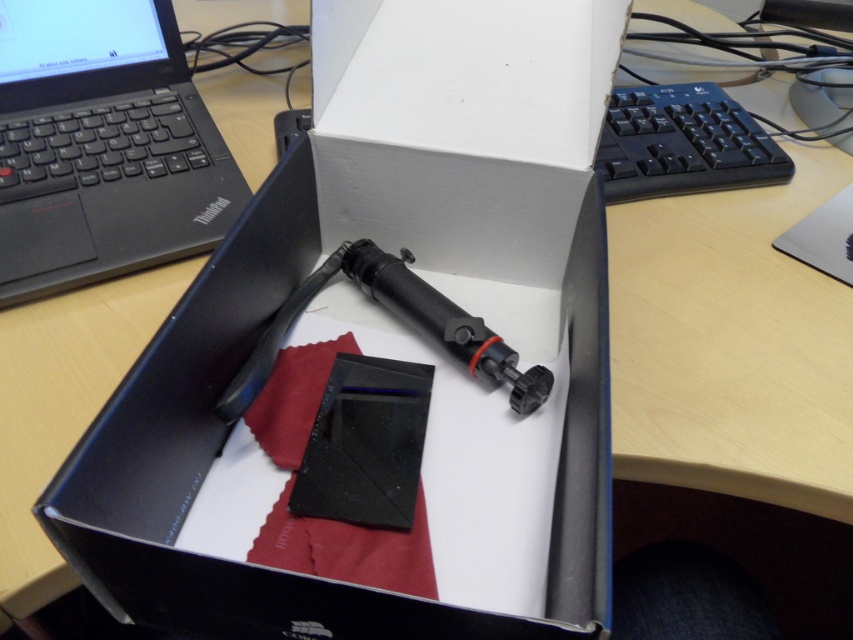
The image size is (853, 640). What do you see at coordinates (102, 145) in the screenshot?
I see `black matte thinkpad at upper left` at bounding box center [102, 145].

Does black matte thinkpad at upper left have a greater height compared to black plastic keyboard at upper right?

Yes.

Who is more distant from viewer, (x=173, y=104) or (x=612, y=193)?

The point (x=173, y=104) is behind.

Locate an element on the screen. The height and width of the screenshot is (640, 853). black matte thinkpad at upper left is located at coordinates (102, 145).

Is point (154, 51) farther from camera compared to point (537, 376)?

That is True.

Between point (235, 172) and point (392, 282), which one is positioned in front?

Positioned in front is point (392, 282).

Locate an element on the screen. This screenshot has height=640, width=853. black matte thinkpad at upper left is located at coordinates (102, 145).

Does black plastic keyboard at upper right appear on the left side of black rubberized pen at center?

Incorrect, black plastic keyboard at upper right is not on the left side of black rubberized pen at center.

At what (x,y) coordinates should I click in order to perform the action: click on black plastic keyboard at upper right. Please return your answer as a coordinate pair (x, y). Looking at the image, I should click on (683, 144).